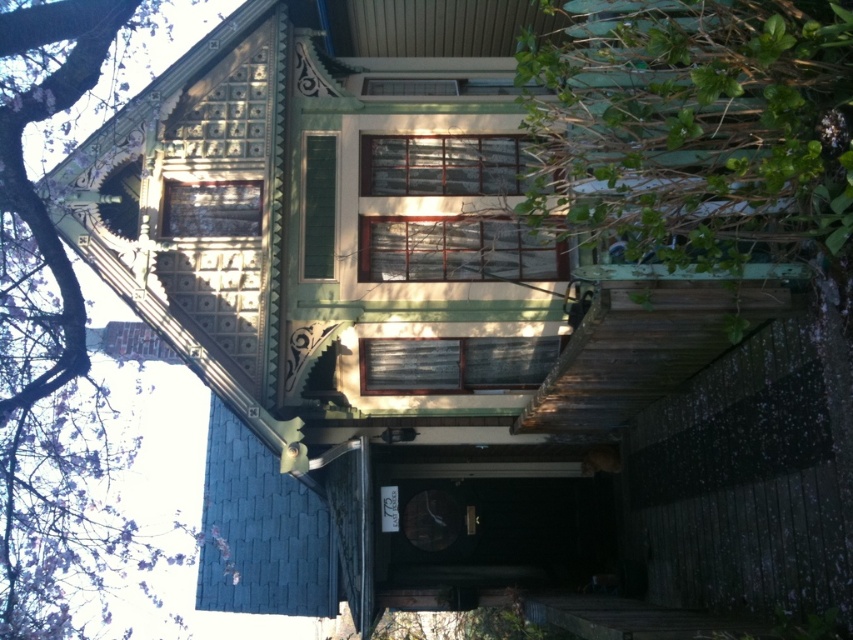
Question: Does green leafy bush at right appear on the right side of purple leafy tree at upper left?

Choices:
 (A) yes
 (B) no

Answer: (A)

Question: Among these points, which one is farthest from the camera?

Choices:
 (A) (767, 192)
 (B) (24, 632)

Answer: (B)

Question: Is green leafy bush at right to the right of purple leafy tree at upper left from the viewer's perspective?

Choices:
 (A) yes
 (B) no

Answer: (A)

Question: Which point appears closest to the camera in this image?

Choices:
 (A) pos(729,33)
 (B) pos(9,356)

Answer: (A)

Question: Is green leafy bush at right smaller than purple leafy tree at upper left?

Choices:
 (A) no
 (B) yes

Answer: (A)

Question: Which point appears closest to the camera in this image?

Choices:
 (A) (809, 225)
 (B) (144, 52)

Answer: (A)